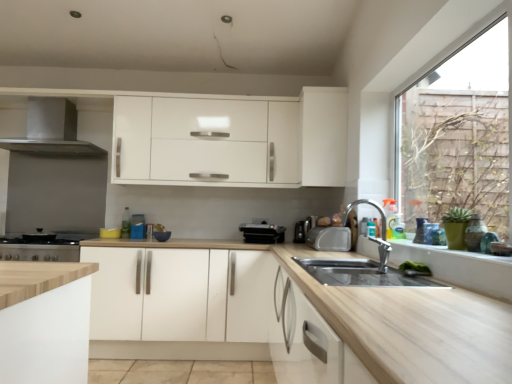
Locate an element on the screen. Image resolution: width=512 pixels, height=384 pixels. white matte cabinet at center, marked as the 1th cabinetry in a left-to-right arrangement is located at coordinates (181, 294).

Describe the element at coordinates (440, 256) in the screenshot. I see `white wood window sill at lower right` at that location.

Describe the element at coordinates (304, 228) in the screenshot. I see `satin silver toaster at center, which ranks as the 2th appliance in right-to-left order` at that location.

How much space does satin black toaster at center, positioned as the third appliance in left-to-right order, occupy horizontally?

satin black toaster at center, positioned as the third appliance in left-to-right order, is 21.56 centimeters wide.

Locate an element on the screen. satin silver toaster at upper right, the 5th appliance when ordered from left to right is located at coordinates (329, 238).

This screenshot has height=384, width=512. Describe the element at coordinates (323, 136) in the screenshot. I see `white matte cabinet at upper center, which appears as the second cabinetry when viewed from the left` at that location.

What do you see at coordinates (262, 233) in the screenshot? I see `black plastic toaster at center, the second appliance in the left-to-right sequence` at bounding box center [262, 233].

Identify the location of white matte cabinet at center, which appears as the 2th cabinetry when viewed from the top. The width and height of the screenshot is (512, 384). (181, 294).

From the image's perspective, is white matte cabinet at upper center, which ranks as the 2th cabinetry in bottom-to-top order, on top of white wood window sill at lower right?

Correct, white matte cabinet at upper center, which ranks as the 2th cabinetry in bottom-to-top order, appears higher than white wood window sill at lower right in the image.

Based on the photo, can you confirm if white matte cabinet at upper center, acting as the first cabinetry starting from the right, is taller than white wood window sill at lower right?

Yes.

Do you think white matte cabinet at upper center, acting as the first cabinetry starting from the right, is within white wood window sill at lower right, or outside of it?

white matte cabinet at upper center, acting as the first cabinetry starting from the right, is outside white wood window sill at lower right.

Find the location of a particular element. cabinetry that is above the white wood window sill at lower right (from the image's perspective) is located at coordinates (323, 136).

Considering the relative sizes of satin black toaster at center, positioned as the third appliance in left-to-right order, and stainless steel stove at lower left, which is the 5th appliance in right-to-left order, in the image provided, is satin black toaster at center, positioned as the third appliance in left-to-right order, taller than stainless steel stove at lower left, which is the 5th appliance in right-to-left order,?

No, satin black toaster at center, positioned as the third appliance in left-to-right order, is not taller than stainless steel stove at lower left, which is the 5th appliance in right-to-left order.

From the image's perspective, would you say satin black toaster at center, the third appliance in the right-to-left sequence, is shown under stainless steel stove at lower left, which is the 5th appliance in right-to-left order?

Actually, satin black toaster at center, the third appliance in the right-to-left sequence, appears above stainless steel stove at lower left, which is the 5th appliance in right-to-left order, in the image.

Would you say satin black toaster at center, positioned as the third appliance in left-to-right order, is outside stainless steel stove at lower left, which is the 5th appliance in right-to-left order?

Yes.

Is satin black toaster at center, the third appliance in the right-to-left sequence, placed right next to stainless steel stove at lower left, which is the 5th appliance in right-to-left order?

No, satin black toaster at center, the third appliance in the right-to-left sequence, is not touching stainless steel stove at lower left, which is the 5th appliance in right-to-left order.

Is satin silver toaster at center, which ranks as the 2th appliance in right-to-left order, outside of satin silver toaster at upper right, positioned as the first appliance in right-to-left order?

Yes, satin silver toaster at center, which ranks as the 2th appliance in right-to-left order, is not within satin silver toaster at upper right, positioned as the first appliance in right-to-left order.

Considering the relative sizes of satin silver toaster at center, the 4th appliance from the left, and satin silver toaster at upper right, the 5th appliance when ordered from left to right, in the image provided, is satin silver toaster at center, the 4th appliance from the left, smaller than satin silver toaster at upper right, the 5th appliance when ordered from left to right,?

Correct, satin silver toaster at center, the 4th appliance from the left, occupies less space than satin silver toaster at upper right, the 5th appliance when ordered from left to right.

Between satin silver toaster at center, which ranks as the 2th appliance in right-to-left order, and satin silver toaster at upper right, positioned as the first appliance in right-to-left order, which one appears on the right side from the viewer's perspective?

From the viewer's perspective, satin silver toaster at upper right, positioned as the first appliance in right-to-left order, appears more on the right side.

From the image's perspective, is satin silver toaster at center, which ranks as the 2th appliance in right-to-left order, positioned above or below satin silver toaster at upper right, positioned as the first appliance in right-to-left order?

Clearly, from the image's perspective, satin silver toaster at center, which ranks as the 2th appliance in right-to-left order, is above satin silver toaster at upper right, positioned as the first appliance in right-to-left order.

Consider the image. Is stainless steel stove at lower left, which ranks as the first appliance in left-to-right order, shorter than black plastic toaster at center, which appears as the fourth appliance when viewed from the right?

No.

Is stainless steel stove at lower left, which is the 5th appliance in right-to-left order, to the left or to the right of black plastic toaster at center, the second appliance in the left-to-right sequence, in the image?

stainless steel stove at lower left, which is the 5th appliance in right-to-left order, is positioned on black plastic toaster at center, the second appliance in the left-to-right sequence,'s left side.

Which is in front, point (54, 261) or point (254, 226)?

The point (54, 261) is in front.

Which point is more forward, (106, 320) or (422, 253)?

The point (422, 253) is closer.

From a real-world perspective, does white matte cabinet at center, which ranks as the 1th cabinetry in bottom-to-top order, stand above white wood window sill at lower right?

No, from a real-world perspective, white matte cabinet at center, which ranks as the 1th cabinetry in bottom-to-top order, is not over white wood window sill at lower right

Who is more distant, white matte cabinet at center, marked as the 1th cabinetry in a left-to-right arrangement, or white wood window sill at lower right?

white matte cabinet at center, marked as the 1th cabinetry in a left-to-right arrangement, is behind.

From the image's perspective, which is below, white matte cabinet at center, marked as the 1th cabinetry in a left-to-right arrangement, or satin silver exhaust hood at left?

white matte cabinet at center, marked as the 1th cabinetry in a left-to-right arrangement, is shown below in the image.

Based on the photo, which is more to the right, white matte cabinet at center, marked as the second cabinetry in a right-to-left arrangement, or satin silver exhaust hood at left?

white matte cabinet at center, marked as the second cabinetry in a right-to-left arrangement.

Which object is closer to the camera, white matte cabinet at center, which ranks as the 1th cabinetry in bottom-to-top order, or satin silver exhaust hood at left?

white matte cabinet at center, which ranks as the 1th cabinetry in bottom-to-top order, is in front.

Find the location of a particular element. exhaust hood above the white matte cabinet at center, which appears as the 2th cabinetry when viewed from the top (from the image's perspective) is located at coordinates (51, 130).

Based on the photo, who is taller, satin black toaster at center, positioned as the third appliance in left-to-right order, or black plastic toaster at center, which appears as the fourth appliance when viewed from the right?

satin black toaster at center, positioned as the third appliance in left-to-right order.

From a real-world perspective, is satin black toaster at center, the third appliance in the right-to-left sequence, above or below black plastic toaster at center, which appears as the fourth appliance when viewed from the right?

satin black toaster at center, the third appliance in the right-to-left sequence, is above black plastic toaster at center, which appears as the fourth appliance when viewed from the right.

Where is `appliance that is the 1st one when counting upward from the satin black toaster at center, positioned as the third appliance in left-to-right order (from the image's perspective)`? appliance that is the 1st one when counting upward from the satin black toaster at center, positioned as the third appliance in left-to-right order (from the image's perspective) is located at coordinates (262, 233).

From the picture: Considering the relative positions of satin black toaster at center, positioned as the third appliance in left-to-right order, and black plastic toaster at center, the second appliance in the left-to-right sequence, in the image provided, is satin black toaster at center, positioned as the third appliance in left-to-right order, to the right of black plastic toaster at center, the second appliance in the left-to-right sequence, from the viewer's perspective?

Yes, satin black toaster at center, positioned as the third appliance in left-to-right order, is to the right of black plastic toaster at center, the second appliance in the left-to-right sequence.

Locate an element on the screen. the 1st cabinetry counting from the left side of the white wood window sill at lower right is located at coordinates (323, 136).

Identify the location of appliance that is the 3rd one below the satin black toaster at center, positioned as the third appliance in left-to-right order (from a real-world perspective). The width and height of the screenshot is (512, 384). (42, 247).

Considering their positions, is stainless steel stove at lower left, which ranks as the first appliance in left-to-right order, positioned closer to satin silver exhaust hood at left than satin silver toaster at center, which ranks as the 2th appliance in right-to-left order?

Based on the image, stainless steel stove at lower left, which ranks as the first appliance in left-to-right order, appears to be nearer to satin silver exhaust hood at left.

Which object lies nearer to the anchor point satin silver toaster at upper right, the 5th appliance when ordered from left to right, satin black toaster at center, the third appliance in the right-to-left sequence, or satin silver exhaust hood at left?

satin black toaster at center, the third appliance in the right-to-left sequence, lies closer to satin silver toaster at upper right, the 5th appliance when ordered from left to right, than the other object.

From the image, which object appears to be farther from satin silver toaster at upper right, positioned as the first appliance in right-to-left order, satin silver toaster at center, which ranks as the 2th appliance in right-to-left order, or white matte cabinet at upper center, acting as the first cabinetry starting from the right?

The object further to satin silver toaster at upper right, positioned as the first appliance in right-to-left order, is white matte cabinet at upper center, acting as the first cabinetry starting from the right.

Based on their spatial positions, is white matte cabinet at center, marked as the 1th cabinetry in a left-to-right arrangement, or satin silver exhaust hood at left further from satin silver toaster at center, which ranks as the 2th appliance in right-to-left order?

Based on the image, satin silver exhaust hood at left appears to be further to satin silver toaster at center, which ranks as the 2th appliance in right-to-left order.

Which object lies further to the anchor point black plastic toaster at center, which appears as the fourth appliance when viewed from the right, stainless steel stove at lower left, which is the 5th appliance in right-to-left order, or white matte cabinet at center, which appears as the 2th cabinetry when viewed from the top?

The object further to black plastic toaster at center, which appears as the fourth appliance when viewed from the right, is stainless steel stove at lower left, which is the 5th appliance in right-to-left order.

Based on their spatial positions, is white wood window sill at lower right or white matte cabinet at center, marked as the 1th cabinetry in a left-to-right arrangement, closer to black plastic toaster at center, the second appliance in the left-to-right sequence?

The object closer to black plastic toaster at center, the second appliance in the left-to-right sequence, is white matte cabinet at center, marked as the 1th cabinetry in a left-to-right arrangement.

Which object lies nearer to the anchor point white wood window sill at lower right, stainless steel stove at lower left, which ranks as the first appliance in left-to-right order, or satin black toaster at center, positioned as the third appliance in left-to-right order?

satin black toaster at center, positioned as the third appliance in left-to-right order, is positioned closer to the anchor white wood window sill at lower right.

Looking at the image, which one is located further to white matte cabinet at center, marked as the 1th cabinetry in a left-to-right arrangement, satin silver toaster at upper right, the 5th appliance when ordered from left to right, or satin silver toaster at center, which ranks as the 2th appliance in right-to-left order?

satin silver toaster at center, which ranks as the 2th appliance in right-to-left order, is positioned further to the anchor white matte cabinet at center, marked as the 1th cabinetry in a left-to-right arrangement.

The image size is (512, 384). Find the location of `exhaust hood between stainless steel stove at lower left, which is the 5th appliance in right-to-left order, and satin silver toaster at upper right, the 5th appliance when ordered from left to right`. exhaust hood between stainless steel stove at lower left, which is the 5th appliance in right-to-left order, and satin silver toaster at upper right, the 5th appliance when ordered from left to right is located at coordinates (51, 130).

Where is `appliance between stainless steel stove at lower left, which is the 5th appliance in right-to-left order, and satin black toaster at center, positioned as the third appliance in left-to-right order, from left to right`? The width and height of the screenshot is (512, 384). appliance between stainless steel stove at lower left, which is the 5th appliance in right-to-left order, and satin black toaster at center, positioned as the third appliance in left-to-right order, from left to right is located at coordinates (262, 233).

Where is `cabinetry located between white matte cabinet at center, marked as the second cabinetry in a right-to-left arrangement, and satin silver toaster at upper right, positioned as the first appliance in right-to-left order, in the left-right direction`? This screenshot has height=384, width=512. cabinetry located between white matte cabinet at center, marked as the second cabinetry in a right-to-left arrangement, and satin silver toaster at upper right, positioned as the first appliance in right-to-left order, in the left-right direction is located at coordinates (323, 136).

This screenshot has height=384, width=512. In order to click on exhaust hood situated between stainless steel stove at lower left, which ranks as the first appliance in left-to-right order, and black plastic toaster at center, the second appliance in the left-to-right sequence, from left to right in this screenshot , I will do `click(51, 130)`.